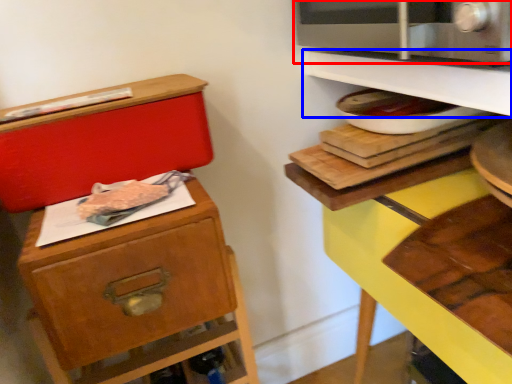
Question: Which of the following is the farthest to the observer, microwave oven (highlighted by a red box) or shelf (highlighted by a blue box)?

Choices:
 (A) microwave oven
 (B) shelf

Answer: (B)